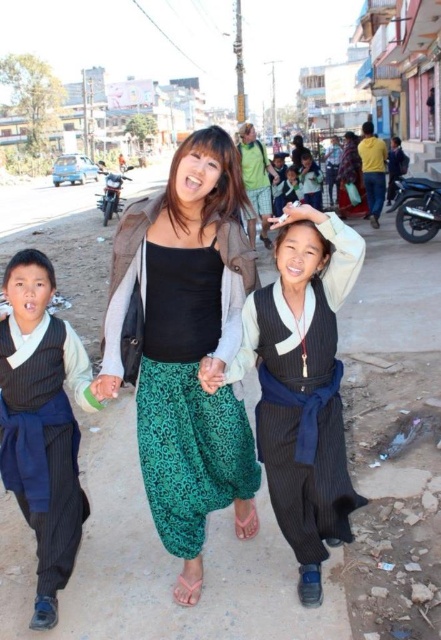
Is dark blue striped vest at left taller than dark blue fabric pants at center?

Yes.

Between point (18, 400) and point (279, 208), which one is positioned behind?

Point (279, 208)

Does point (74, 486) come farther from viewer compared to point (298, 198)?

That is False.

Locate an element on the screen. Image resolution: width=441 pixels, height=640 pixels. dark blue striped vest at left is located at coordinates (43, 422).

Does black pinstriped dress at center appear over green printed fabric pants at center?

Yes, black pinstriped dress at center is above green printed fabric pants at center.

Based on the photo, is black pinstriped dress at center smaller than green printed fabric pants at center?

Incorrect, black pinstriped dress at center is not smaller in size than green printed fabric pants at center.

Does point (269, 472) come farther from viewer compared to point (164, 241)?

That is False.

This screenshot has width=441, height=640. I want to click on black pinstriped dress at center, so click(x=302, y=428).

Can you confirm if black pinstriped vest at center is positioned to the right of green fabric hand at center?

Correct, you'll find black pinstriped vest at center to the right of green fabric hand at center.

Who is more forward, (309,394) or (98,381)?

Point (98,381)

This screenshot has width=441, height=640. Identify the location of black pinstriped vest at center. (303, 385).